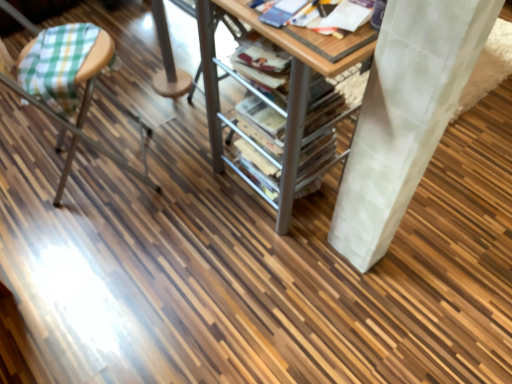
Find the location of a particular element. vacant area that is situated to the right of green plaid fabric stool at left is located at coordinates (179, 188).